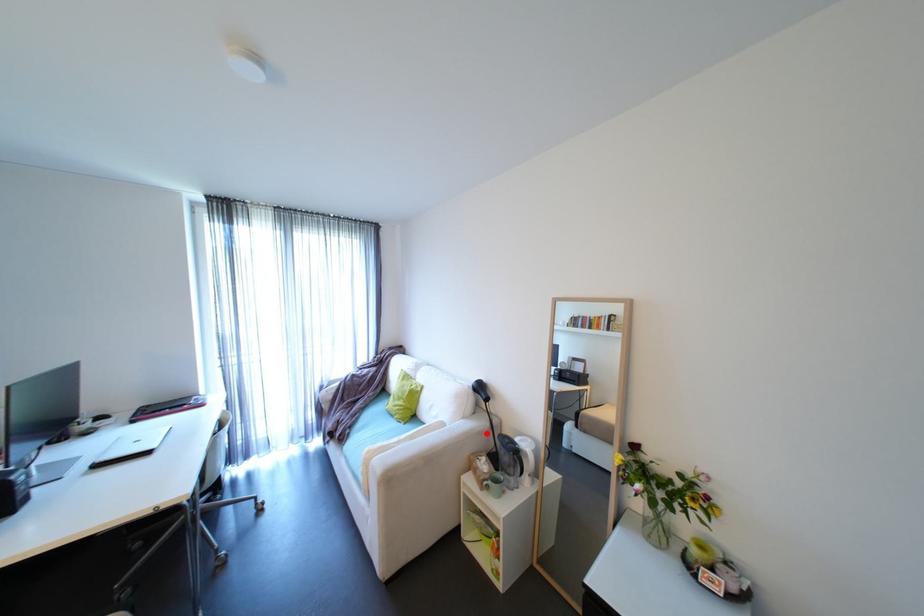
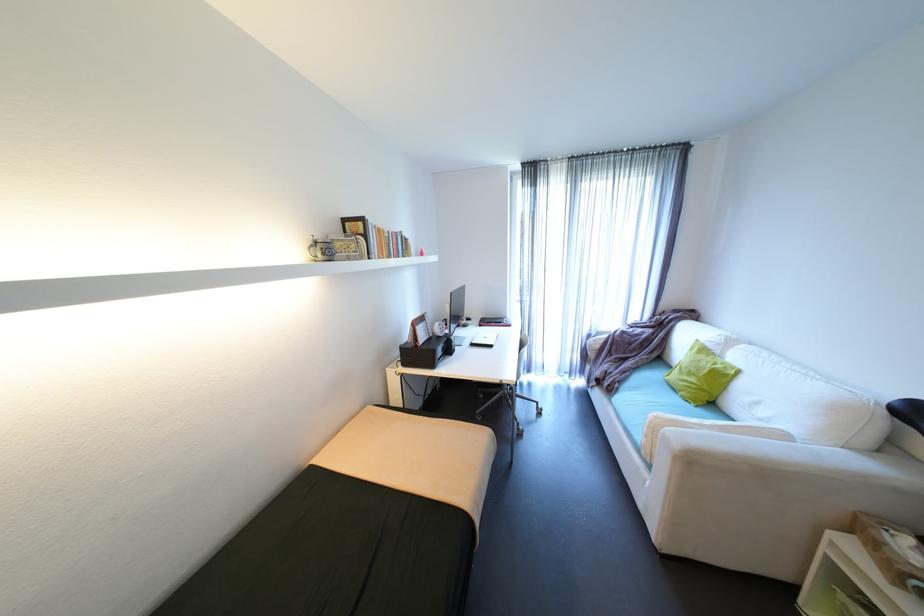
In the second image, find the point that corresponds to the highlighted location in the first image.

(907, 493)